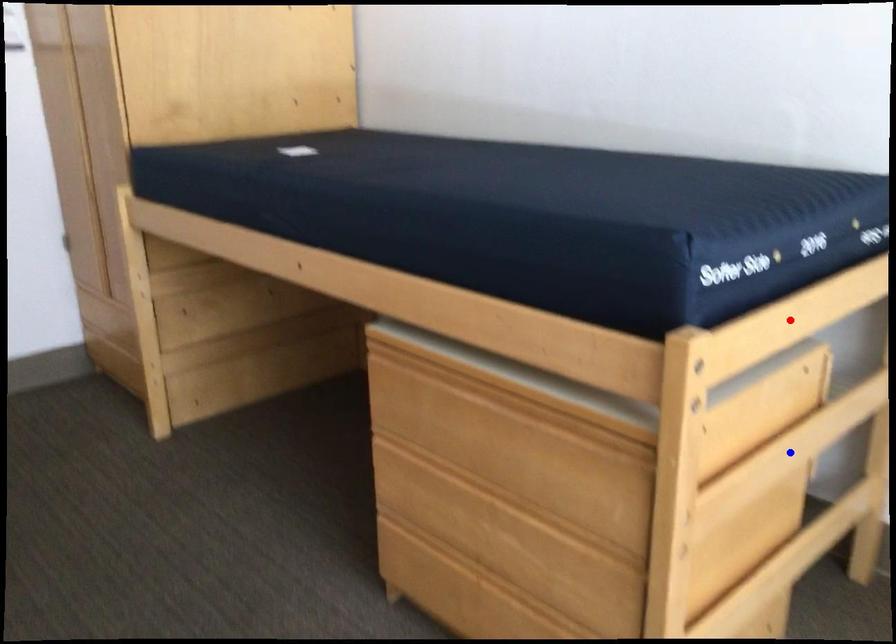
Question: Two points are marked on the image. Which point is closer to the camera?

Choices:
 (A) Blue point is closer.
 (B) Red point is closer.

Answer: (B)